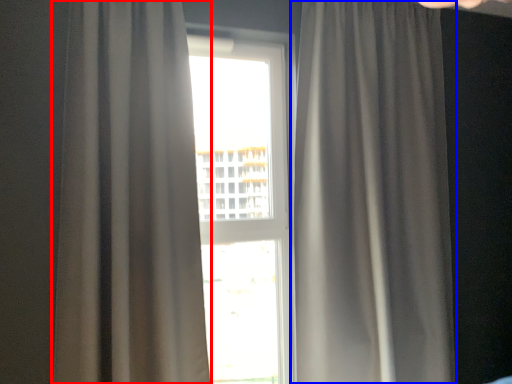
Question: Which of the following is the farthest to the observer, curtain (highlighted by a red box) or curtain (highlighted by a blue box)?

Choices:
 (A) curtain
 (B) curtain

Answer: (B)